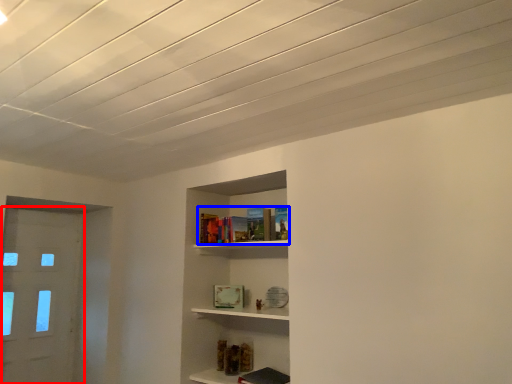
Question: Among these objects, which one is nearest to the camera, door (highlighted by a red box) or book (highlighted by a blue box)?

Choices:
 (A) door
 (B) book

Answer: (B)